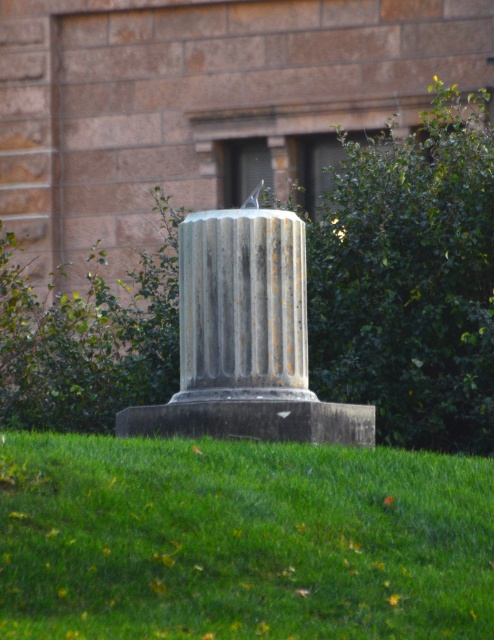
Consider the image. Who is more distant from viewer, (31, 499) or (417, 170)?

Point (417, 170)

Is point (132, 620) more distant than point (485, 216)?

No, (132, 620) is closer to viewer.

Between point (116, 504) and point (442, 429), which one is positioned behind?

Positioned behind is point (442, 429).

You are a GUI agent. You are given a task and a screenshot of the screen. Output one action in this format:
    pyautogui.click(x=<x>, y=<y>)
    Task: Click on the green grass at center
    
    Given the screenshot: What is the action you would take?
    pyautogui.click(x=244, y=540)

Between green leafy bush at center and gray stone column at center, which one appears on the left side from the viewer's perspective?

From the viewer's perspective, gray stone column at center appears more on the left side.

Is point (493, 157) positioned after point (278, 376)?

Yes.

Is point (416, 304) positioned behind point (284, 372)?

Yes, point (416, 304) is farther from viewer.

This screenshot has width=494, height=640. Find the location of `green leafy bush at center`. green leafy bush at center is located at coordinates (410, 278).

Based on the photo, is green grass at center taller than gray stone column at center?

In fact, green grass at center may be shorter than gray stone column at center.

Who is positioned more to the left, green grass at center or gray stone column at center?

From the viewer's perspective, gray stone column at center appears more on the left side.

Which is behind, point (466, 531) or point (243, 225)?

Positioned behind is point (243, 225).

Find the location of a particular element. The image size is (494, 640). green grass at center is located at coordinates (244, 540).